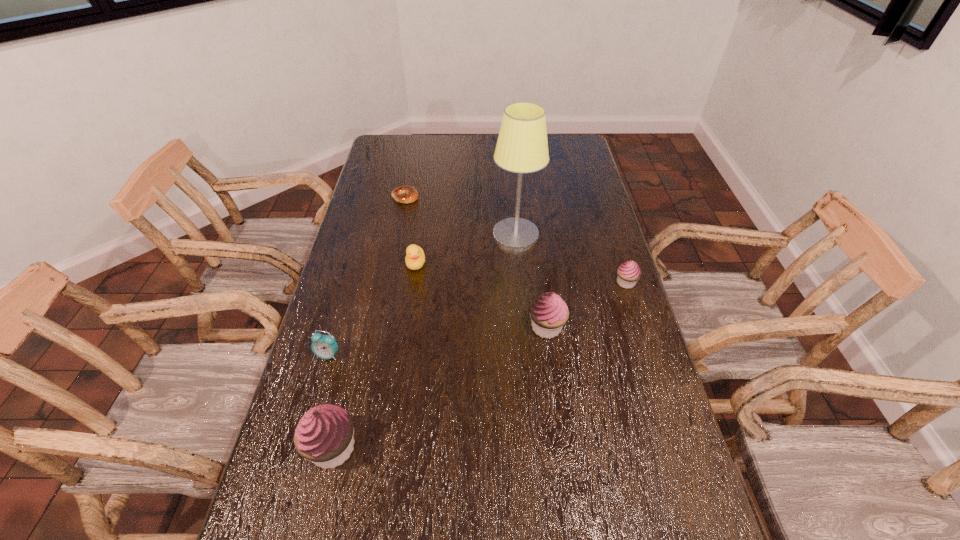
Locate an element on the screen. The image size is (960, 540). table lamp is located at coordinates (522, 147).

Find the location of a particular element. The height and width of the screenshot is (540, 960). alarm clock is located at coordinates (324, 346).

Where is `free space located on the right of the nearest object`? This screenshot has height=540, width=960. free space located on the right of the nearest object is located at coordinates (513, 448).

Identify the location of free region located on the front of the second shortest cupcake. (564, 460).

Identify the location of vacant region located on the back of the rightmost object. Image resolution: width=960 pixels, height=540 pixels. (605, 217).

Where is `vacant region located 0.340m on the right of the shortest object`? vacant region located 0.340m on the right of the shortest object is located at coordinates (506, 197).

Locate an element on the screen. Image resolution: width=960 pixels, height=540 pixels. vacant space located on the face of the fifth nearest object is located at coordinates (405, 339).

The height and width of the screenshot is (540, 960). In order to click on vacant space located on the left of the table lamp in this screenshot , I will do [446, 235].

Identify the location of vacant space located 0.200m on the face of the alarm clock. This screenshot has width=960, height=540. (306, 433).

Locate an element on the screen. The height and width of the screenshot is (540, 960). cupcake situated at the left edge is located at coordinates (324, 435).